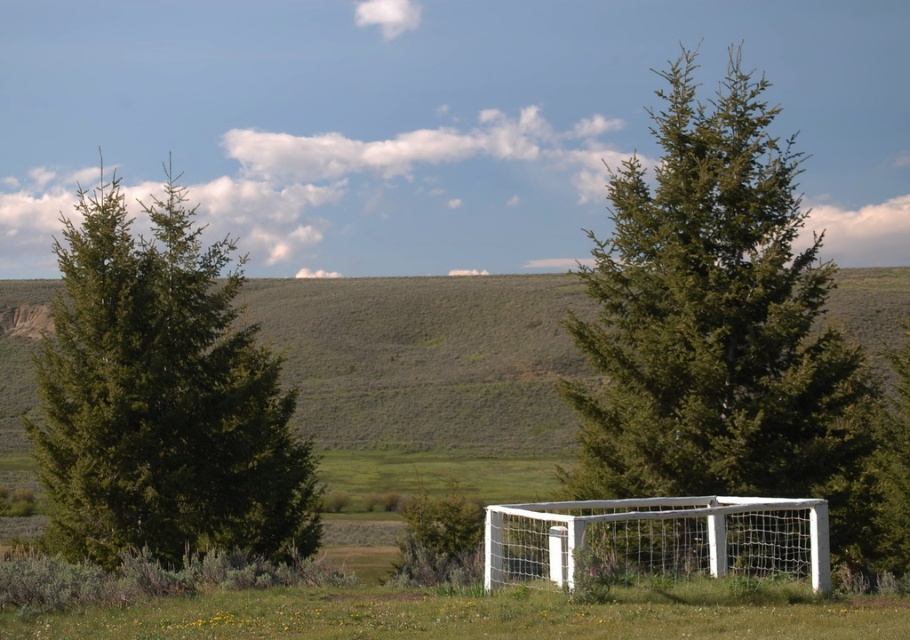
You are a soccer player preparing to take a penalty kick. You notice the green grassy hillside at center and the white mesh net at center. Which object is bigger in size?

The green grassy hillside at center is larger in size than the white mesh net at center.

You are a painter setting up your easel to capture the rural landscape. You want to ensure that both the green matte tree at center and the white mesh net at center are clearly visible in your painting. Given their sizes, which object should you position closer to the foreground to maintain their visibility?

The green matte tree at center has a larger width than the white mesh net at center. To ensure both are clearly visible, position the white mesh net at center closer to the foreground since its smaller size might require it to be nearer to the viewer for better visibility.

You are standing at the base of the green grassy hillside at center and want to look at the green matte tree at left. In which direction should you turn your head to see it?

The green matte tree at left is located above the green grassy hillside at center, so you should look upward to see it.